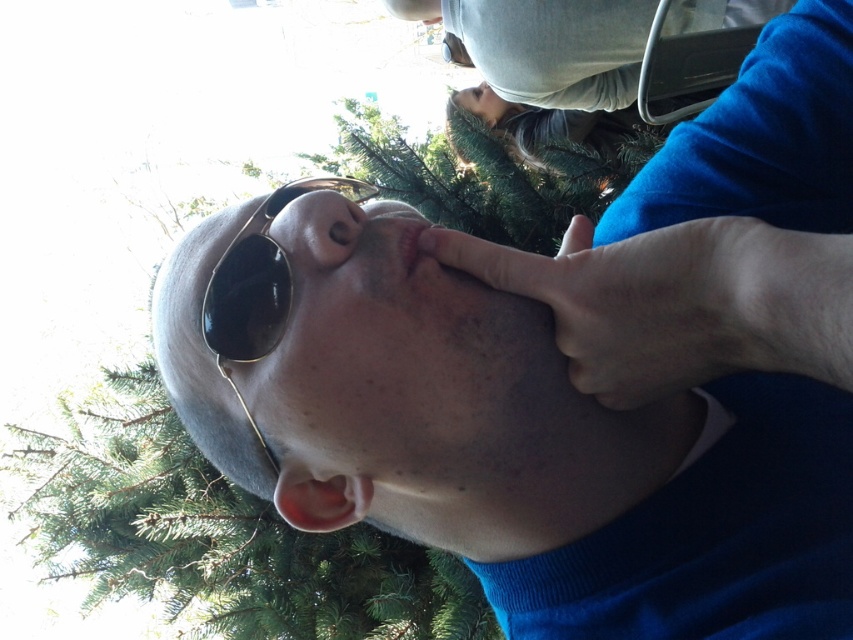
Is matte black nose at center closer to camera compared to pink matte lips at center?

That is False.

Between matte black nose at center and pink matte lips at center, which one is positioned lower?

pink matte lips at center is below.

Find the location of a particular element. The image size is (853, 640). matte black nose at center is located at coordinates (318, 225).

Is point (453, 211) more distant than point (413, 236)?

That is True.

Between green matte tree at center and pink matte lips at center, which one has more height?

Standing taller between the two is green matte tree at center.

Image resolution: width=853 pixels, height=640 pixels. I want to click on green matte tree at center, so click(222, 538).

Looking at this image, is matte black sunglasses at center to the left of black metallic goggles at center from the viewer's perspective?

Correct, you'll find matte black sunglasses at center to the left of black metallic goggles at center.

How much distance is there between matte black sunglasses at center and black metallic goggles at center?

matte black sunglasses at center and black metallic goggles at center are 0.77 inches apart.

Who is more distant from viewer, (x=170, y=308) or (x=265, y=220)?

The point (x=265, y=220) is behind.

This screenshot has height=640, width=853. Identify the location of matte black sunglasses at center. click(235, 321).